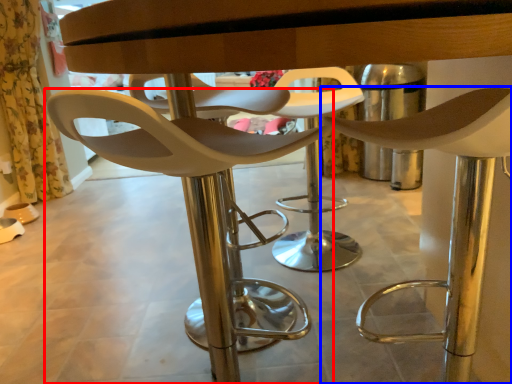
Question: Which of the following is the closest to the observer, chair (highlighted by a red box) or chair (highlighted by a blue box)?

Choices:
 (A) chair
 (B) chair

Answer: (B)